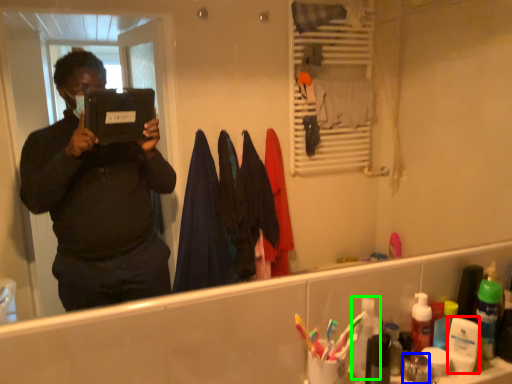
Question: Which is nearer to the toiletry (highlighted by a red box)? toiletry (highlighted by a blue box) or toiletry (highlighted by a green box).

Choices:
 (A) toiletry
 (B) toiletry

Answer: (A)